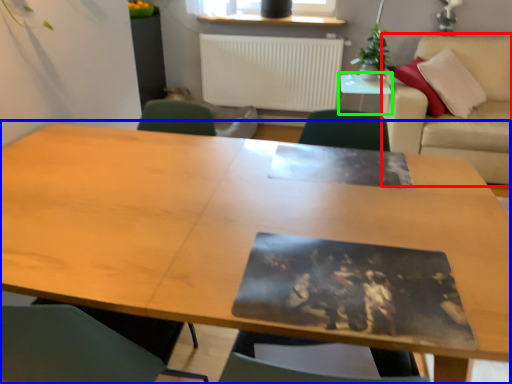
Question: Estimate the real-world distances between objects in this image. Which object is farther from couch (highlighted by a red box), table (highlighted by a blue box) or side table (highlighted by a green box)?

Choices:
 (A) table
 (B) side table

Answer: (A)